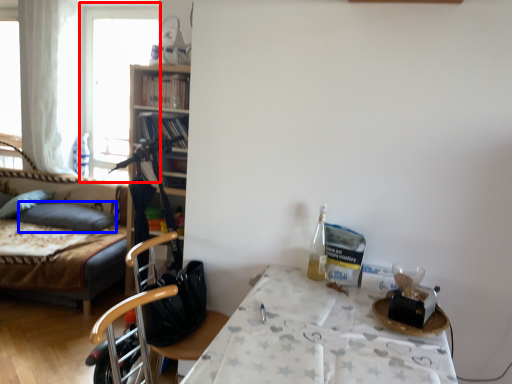
Question: Which of the following is the closest to the observer, window (highlighted by a red box) or pillow (highlighted by a blue box)?

Choices:
 (A) window
 (B) pillow

Answer: (B)